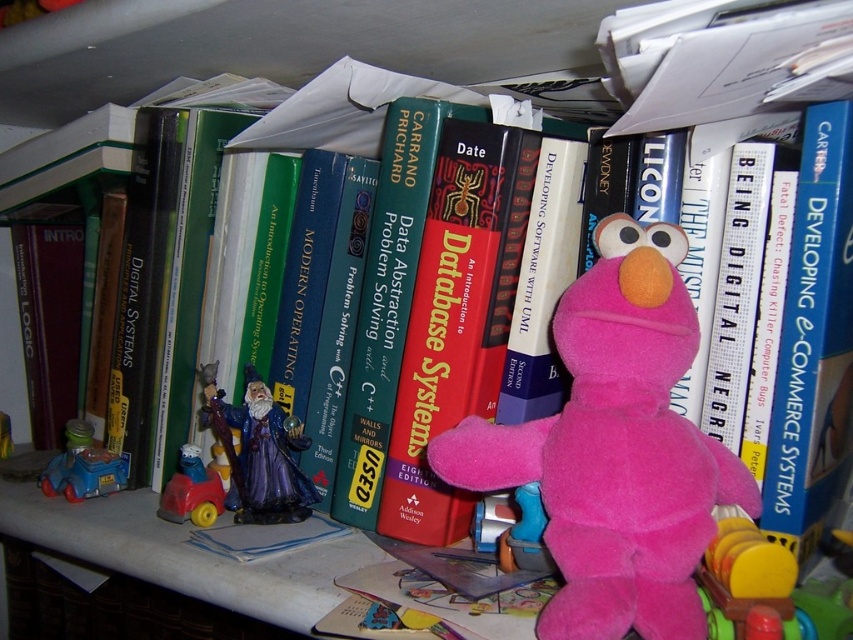
Question: Does blue plastic car at lower left appear on the right side of plastic toy car at left?

Choices:
 (A) no
 (B) yes

Answer: (A)

Question: Which object is farther from the camera taking this photo?

Choices:
 (A) shiny purple wizard figurine at center-left
 (B) pink plush at center
 (C) blue plastic car at lower left

Answer: (C)

Question: Is shiny purple wizard figurine at center-left positioned at the back of plastic toy car at left?

Choices:
 (A) no
 (B) yes

Answer: (A)

Question: Estimate the real-world distances between objects in this image. Which object is farther from the shiny purple wizard figurine at center-left?

Choices:
 (A) pink plush at center
 (B) blue plastic car at lower left

Answer: (A)

Question: Is shiny purple wizard figurine at center-left positioned before blue plastic car at lower left?

Choices:
 (A) no
 (B) yes

Answer: (B)

Question: Which point is farther to the camera?

Choices:
 (A) (102, 451)
 (B) (256, 401)

Answer: (A)